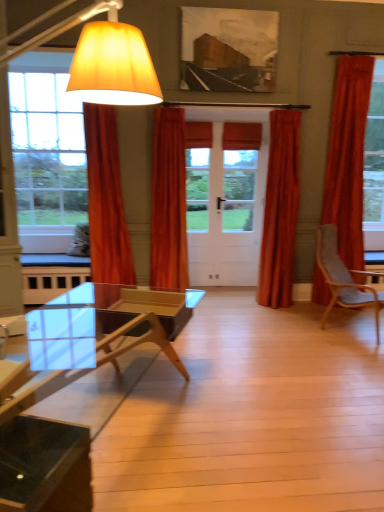
Image resolution: width=384 pixels, height=512 pixels. What are the coordinates of `vacant space situated on the left part of gray fabric chair at right` in the screenshot? It's located at (279, 328).